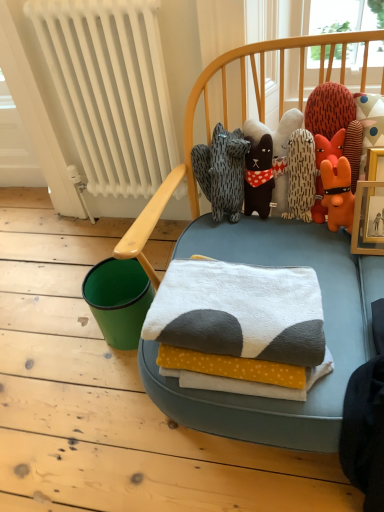
Measure the distance between white soft towel at center and camera.

The distance of white soft towel at center from camera is 33.82 inches.

Where is `soft plush toys at center, the 2th toy when ordered from right to left`? The height and width of the screenshot is (512, 384). soft plush toys at center, the 2th toy when ordered from right to left is located at coordinates (276, 130).

Between white painted metal radiator at left and white soft towel at center, which one is positioned behind?

white painted metal radiator at left is further from the camera.

Is white painted metal radiator at left smaller than white soft towel at center?

Actually, white painted metal radiator at left might be larger than white soft towel at center.

Does white soft towel at center appear on the left side of soft plush toys at center, which appears as the first toy when viewed from the left?

Yes, white soft towel at center is to the left of soft plush toys at center, which appears as the first toy when viewed from the left.

From a real-world perspective, is white soft towel at center beneath soft plush toys at center, which appears as the first toy when viewed from the left?

Correct, in the physical world, white soft towel at center is lower than soft plush toys at center, which appears as the first toy when viewed from the left.

This screenshot has height=512, width=384. Identify the location of bath towel in front of the soft plush toys at center, which appears as the first toy when viewed from the left. (239, 311).

How different are the orientations of white soft towel at center and soft plush toys at center, the 2th toy when ordered from right to left, in degrees?

They differ by 1.26 degrees in their facing directions.

Does point (296, 117) lie behind point (344, 94)?

Yes.

Which object is closer to the camera, soft plush toys at center, the 2th toy when ordered from right to left, or orange plush toy at upper right, the second toy when ordered from left to right?

orange plush toy at upper right, the second toy when ordered from left to right, is in front.

Is soft plush toys at center, which appears as the first toy when viewed from the left, positioned beyond the bounds of orange plush toy at upper right, the second toy when ordered from left to right?

No.

Which object is positioned more to the left, soft plush toys at center, which appears as the first toy when viewed from the left, or orange plush toy at upper right, the second toy when ordered from left to right?

soft plush toys at center, which appears as the first toy when viewed from the left.

From the image's perspective, does soft plush toys at center, the 2th toy when ordered from right to left, appear lower than white painted metal radiator at left?

Yes, from the image's perspective, soft plush toys at center, the 2th toy when ordered from right to left, is below white painted metal radiator at left.

From a real-world perspective, which object stands above the other?

white painted metal radiator at left.

Consider the image. Can you see soft plush toys at center, the 2th toy when ordered from right to left, touching white painted metal radiator at left?

No, soft plush toys at center, the 2th toy when ordered from right to left, is not with white painted metal radiator at left.

Visually, is soft plush toys at center, which appears as the first toy when viewed from the left, positioned to the left or to the right of white painted metal radiator at left?

From the image, it's evident that soft plush toys at center, which appears as the first toy when viewed from the left, is to the right of white painted metal radiator at left.

Is soft plush toys at center, which appears as the first toy when viewed from the left, wider or thinner than white soft towel at center?

Clearly, soft plush toys at center, which appears as the first toy when viewed from the left, has less width compared to white soft towel at center.

Is point (279, 206) closer to camera compared to point (266, 294)?

No, it is not.

Is soft plush toys at center, the 2th toy when ordered from right to left, situated inside white soft towel at center or outside?

soft plush toys at center, the 2th toy when ordered from right to left, exists outside the volume of white soft towel at center.

Does point (156, 168) lie behind point (280, 190)?

Yes, point (156, 168) is farther from viewer.

Is white painted metal radiator at left taller or shorter than soft plush toys at center, the 2th toy when ordered from right to left?

In the image, white painted metal radiator at left appears to be taller than soft plush toys at center, the 2th toy when ordered from right to left.

From the picture: Is white painted metal radiator at left facing towards soft plush toys at center, which appears as the first toy when viewed from the left?

No, white painted metal radiator at left is not turned towards soft plush toys at center, which appears as the first toy when viewed from the left.

Which is behind, white painted metal radiator at left or soft plush toys at center, the 2th toy when ordered from right to left?

white painted metal radiator at left is further from the camera.

Considering the relative positions of orange plush toy at upper right, which ranks as the 1th toy in right-to-left order, and white painted metal radiator at left in the image provided, is orange plush toy at upper right, which ranks as the 1th toy in right-to-left order, to the left of white painted metal radiator at left from the viewer's perspective?

Incorrect, orange plush toy at upper right, which ranks as the 1th toy in right-to-left order, is not on the left side of white painted metal radiator at left.

Could you tell me if orange plush toy at upper right, which ranks as the 1th toy in right-to-left order, is facing white painted metal radiator at left?

No, orange plush toy at upper right, which ranks as the 1th toy in right-to-left order, is not turned towards white painted metal radiator at left.

From a real-world perspective, is orange plush toy at upper right, the second toy when ordered from left to right, positioned above or below white painted metal radiator at left?

From a real-world perspective, orange plush toy at upper right, the second toy when ordered from left to right, is physically above white painted metal radiator at left.

Between orange plush toy at upper right, the second toy when ordered from left to right, and white painted metal radiator at left, which one is positioned behind?

white painted metal radiator at left.

At what (x,y) coordinates should I click in order to perform the action: click on radiator lying on the left of white soft towel at center. Please return your answer as a coordinate pair (x, y). This screenshot has height=512, width=384. Looking at the image, I should click on click(x=111, y=89).

Where is `toy that is the 2nd one when counting backward from the white soft towel at center`? The width and height of the screenshot is (384, 512). toy that is the 2nd one when counting backward from the white soft towel at center is located at coordinates (276, 130).

From the image, which object appears to be farther from soft plush toys at center, the 2th toy when ordered from right to left, orange plush toy at upper right, the second toy when ordered from left to right, or white soft towel at center?

Based on the image, white soft towel at center appears to be further to soft plush toys at center, the 2th toy when ordered from right to left.

When comparing their distances from white painted metal radiator at left, does white soft towel at center or soft plush toys at center, which appears as the first toy when viewed from the left, seem further?

white soft towel at center lies further to white painted metal radiator at left than the other object.

Which object lies further to the anchor point white painted metal radiator at left, white soft towel at center or orange plush toy at upper right, which ranks as the 1th toy in right-to-left order?

white soft towel at center lies further to white painted metal radiator at left than the other object.

Based on their spatial positions, is soft plush toys at center, which appears as the first toy when viewed from the left, or white painted metal radiator at left closer to white soft towel at center?

The object closer to white soft towel at center is soft plush toys at center, which appears as the first toy when viewed from the left.

Estimate the real-world distances between objects in this image. Which object is closer to white soft towel at center, soft plush toys at center, the 2th toy when ordered from right to left, or orange plush toy at upper right, which ranks as the 1th toy in right-to-left order?

orange plush toy at upper right, which ranks as the 1th toy in right-to-left order, is closer to white soft towel at center.

Looking at this image, from the image, which object appears to be farther from soft plush toys at center, the 2th toy when ordered from right to left, white soft towel at center or orange plush toy at upper right, which ranks as the 1th toy in right-to-left order?

white soft towel at center lies further to soft plush toys at center, the 2th toy when ordered from right to left, than the other object.

From the picture: From the image, which object appears to be farther from orange plush toy at upper right, which ranks as the 1th toy in right-to-left order, white soft towel at center or soft plush toys at center, the 2th toy when ordered from right to left?

white soft towel at center.

Considering their positions, is soft plush toys at center, which appears as the first toy when viewed from the left, positioned closer to white painted metal radiator at left than white soft towel at center?

Among the two, soft plush toys at center, which appears as the first toy when viewed from the left, is located nearer to white painted metal radiator at left.

This screenshot has height=512, width=384. I want to click on toy between white painted metal radiator at left and orange plush toy at upper right, which ranks as the 1th toy in right-to-left order, so click(x=276, y=130).

This screenshot has width=384, height=512. What are the coordinates of `toy between orange plush toy at upper right, the second toy when ordered from left to right, and white soft towel at center vertically` in the screenshot? It's located at (276, 130).

Identify the location of bath towel between white painted metal radiator at left and orange plush toy at upper right, the second toy when ordered from left to right, from left to right. pos(239,311).